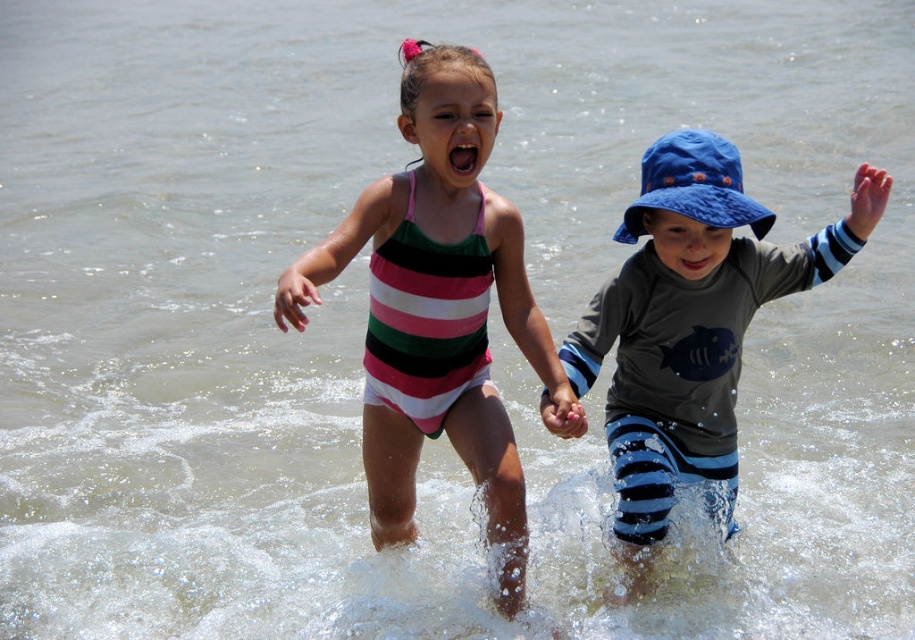
Question: Is striped fabric swimsuit at center bigger than blue striped shorts at center?

Choices:
 (A) no
 (B) yes

Answer: (B)

Question: Is striped fabric swimsuit at center below blue striped shorts at center?

Choices:
 (A) yes
 (B) no

Answer: (B)

Question: Does striped fabric swimsuit at center appear under blue striped shorts at center?

Choices:
 (A) no
 (B) yes

Answer: (A)

Question: Which point appears farthest from the camera in this image?

Choices:
 (A) coord(669,250)
 (B) coord(377,502)

Answer: (B)

Question: Among these objects, which one is nearest to the camera?

Choices:
 (A) blue striped shorts at center
 (B) striped fabric swimsuit at center

Answer: (B)